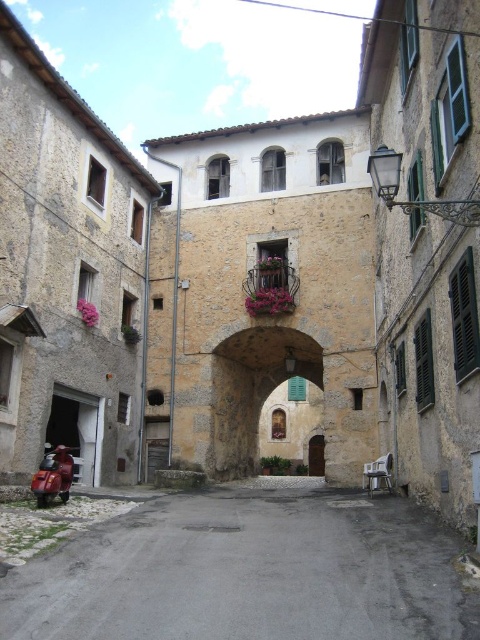
You are a delivery person trying to navigate through the narrow street. You see the gray concrete alley at center and the metallic red scooter at lower left. Which object is closer to your current position if you are standing at the entrance of the building on the left?

The metallic red scooter at lower left is closer to your current position because it is positioned on the left side of the gray concrete alley at center, which is further to the right.

You are a delivery person with a 2.5 meter long cart. You need to navigate through the narrow street and pass between the stone archway at center and the red scooter parked on the left. Can your cart fit through the space between them?

The distance between the stone archway at center and the red scooter parked on the left is 65.81 meters. Since your cart is only 2.5 meters long, there is more than enough space for it to pass through comfortably.

In the scene shown: You are a delivery person trying to navigate through the gray concrete alley at center and the stone archway at center. Which structure should you approach first if you want to enter the street from the right side?

You should approach the stone archway at center first because the gray concrete alley at center is to the left of it. Since you are coming from the right side, the stone archway at center would be closer to your starting position.